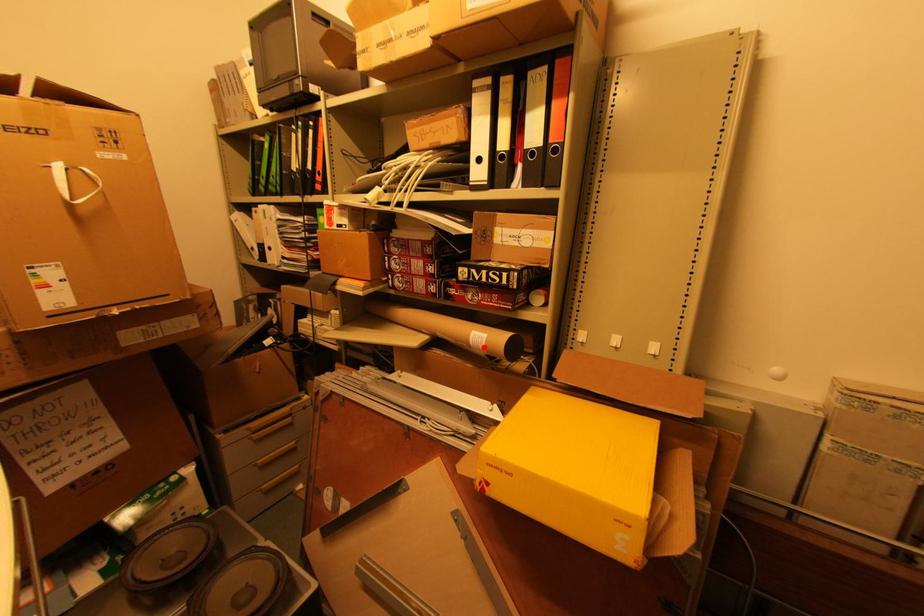
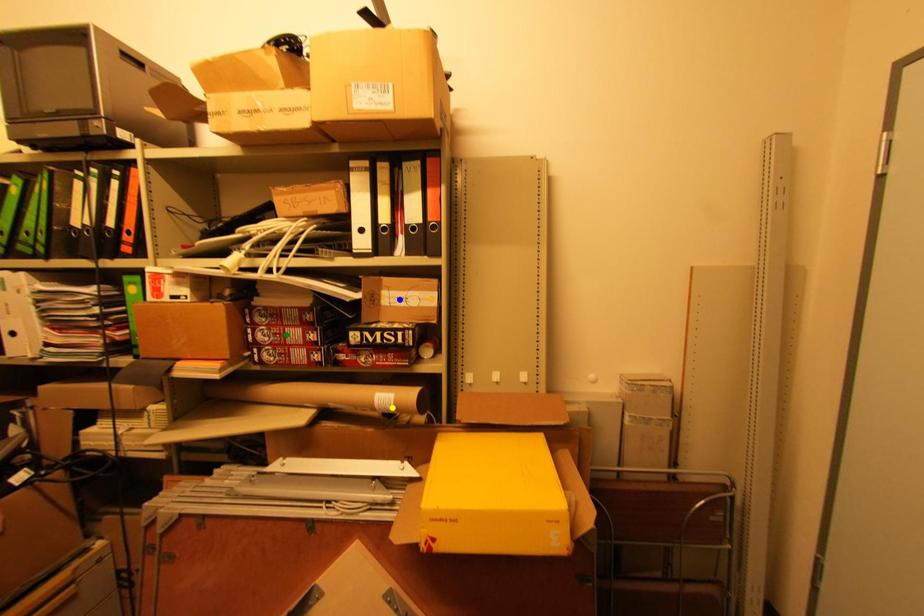
Question: I am providing you with two images of the same scene from different viewpoints. A red point is marked on the first image. You are given multiple points on the second image. Can you choose the point in image 2 that corresponds to the point in image 1?

Choices:
 (A) yellow point
 (B) green point
 (C) blue point

Answer: (A)